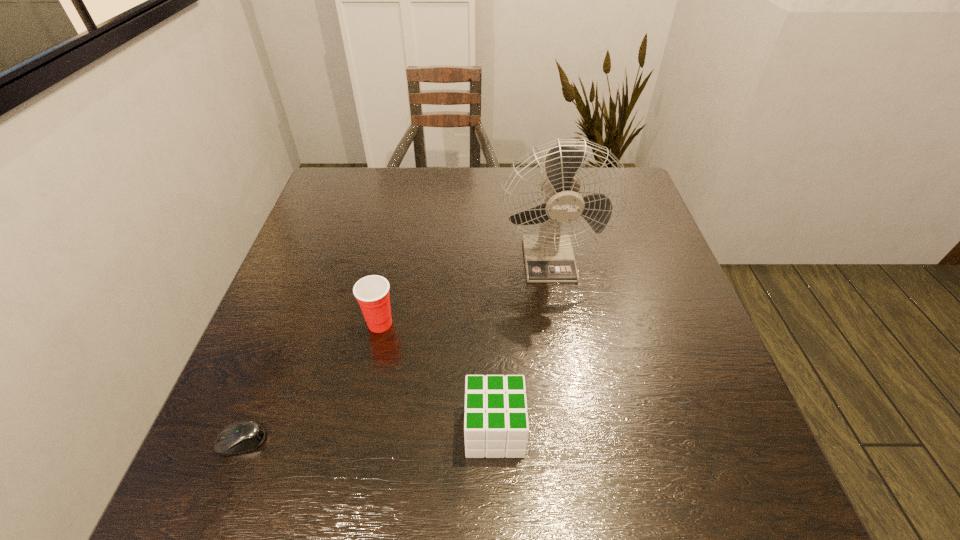
In order to click on free space located on the red face of the cube in this screenshot , I will do `click(350, 430)`.

This screenshot has width=960, height=540. Find the location of `vacant space situated on the red face of the cube`. vacant space situated on the red face of the cube is located at coordinates (300, 430).

Image resolution: width=960 pixels, height=540 pixels. I want to click on free space located 0.060m on the right of the shortest object, so click(300, 441).

I want to click on cube that is at the near edge, so click(496, 425).

The image size is (960, 540). Find the location of `mouse that is at the near edge`. mouse that is at the near edge is located at coordinates (239, 437).

The height and width of the screenshot is (540, 960). In order to click on object at the left edge in this screenshot , I will do `click(239, 437)`.

Locate an element on the screen. This screenshot has width=960, height=540. object present at the near left corner is located at coordinates (239, 437).

Image resolution: width=960 pixels, height=540 pixels. I want to click on vacant point at the far edge, so click(x=458, y=208).

The image size is (960, 540). In the image, there is a desktop. In order to click on vacant area at the near edge in this screenshot , I will do `click(650, 469)`.

Locate an element on the screen. This screenshot has height=540, width=960. free spot at the left edge of the desktop is located at coordinates (309, 299).